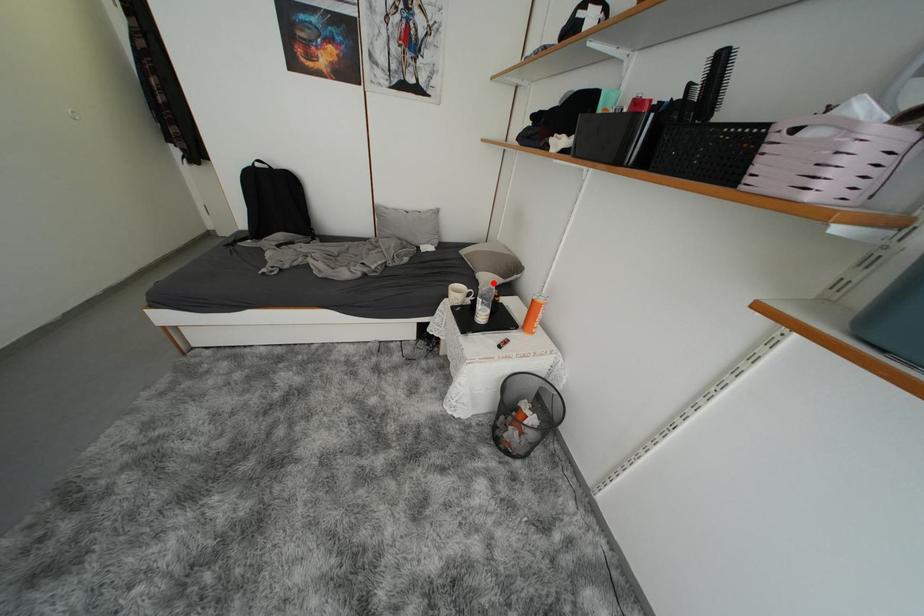
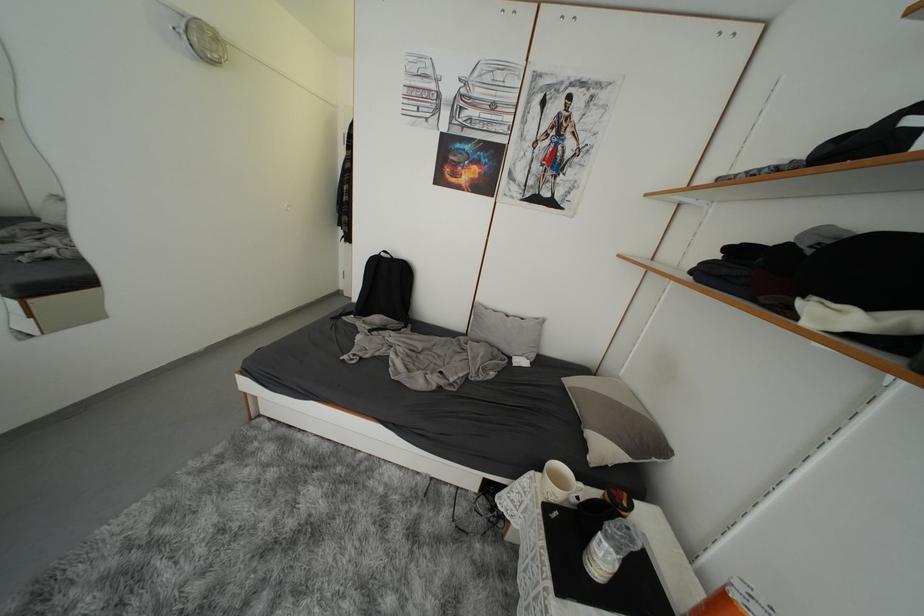
Question: A red point is marked in image1. In image2, is the corresponding 3D point closer to the camera or farther? Reply with the corresponding letter.

Choices:
 (A) The corresponding 3D point is closer.
 (B) The corresponding 3D point is farther.

Answer: (A)